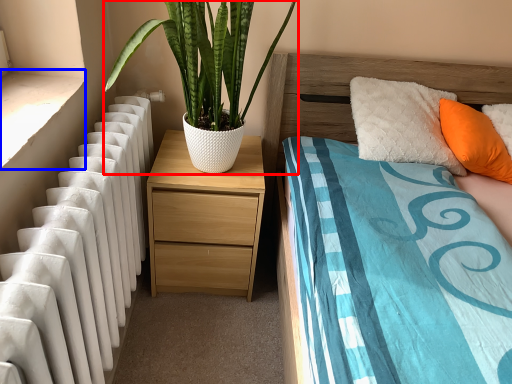
Question: Which object is closer to the camera taking this photo, houseplant (highlighted by a red box) or window sill (highlighted by a blue box)?

Choices:
 (A) houseplant
 (B) window sill

Answer: (B)